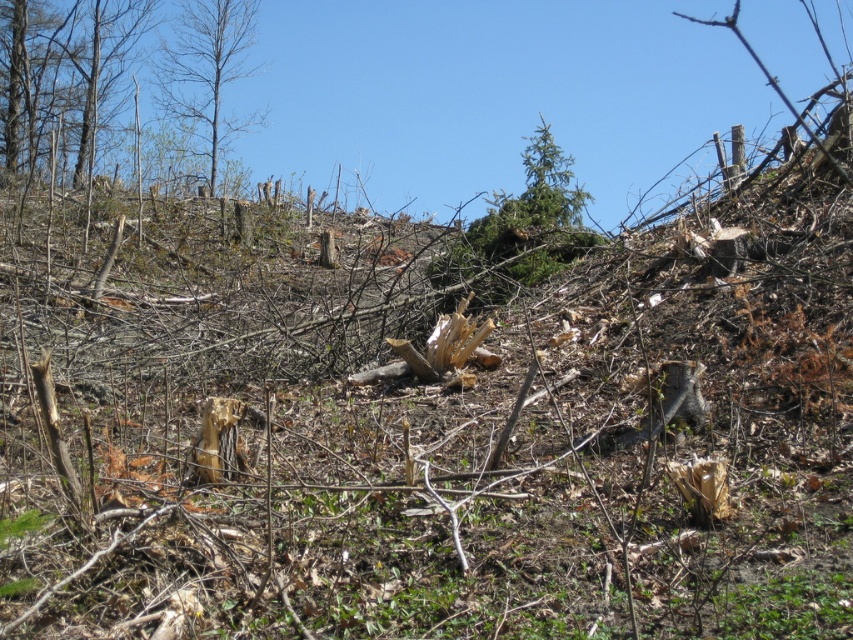
You are an environmental inspector assessing the deforested area. You notice the green leafy tree at upper center and the bare wood tree at upper left. Which tree has a smaller trunk diameter?

The green leafy tree at upper center is thinner than the bare wood tree at upper left, so it has a smaller trunk diameter.

You are a drone operator flying a drone over a deforested area. You need to determine the distance between two points marked in the image. The first point is at coordinates point [38,131] and the second point is at point [566,228]. Based on the image description, can you determine which point is closer to the camera?

Point [38,131] is further to the camera than point [566,228].

You are a forester assessing the deforested area. You notice the smooth bark tree at upper left and the bare wood tree at upper left. Which of these two trees has a greater width?

The smooth bark tree at upper left has a greater width than the bare wood tree at upper left.